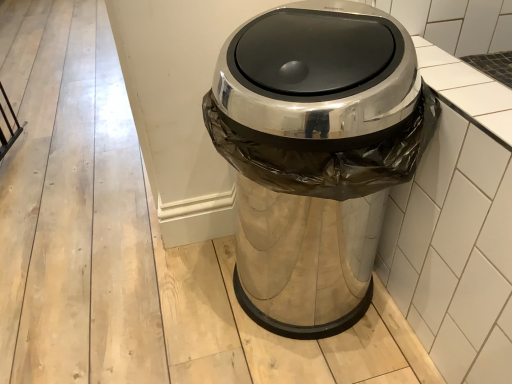
What do you see at coordinates (315, 155) in the screenshot? I see `polished stainless steel trash can at center` at bounding box center [315, 155].

You are a GUI agent. You are given a task and a screenshot of the screen. Output one action in this format:
    pyautogui.click(x=<x>, y=<y>)
    Task: Click on the polished stainless steel trash can at center
    The image size is (512, 384).
    Given the screenshot: What is the action you would take?
    pyautogui.click(x=315, y=155)

This screenshot has width=512, height=384. Find the location of `polished stainless steel trash can at center`. polished stainless steel trash can at center is located at coordinates (315, 155).